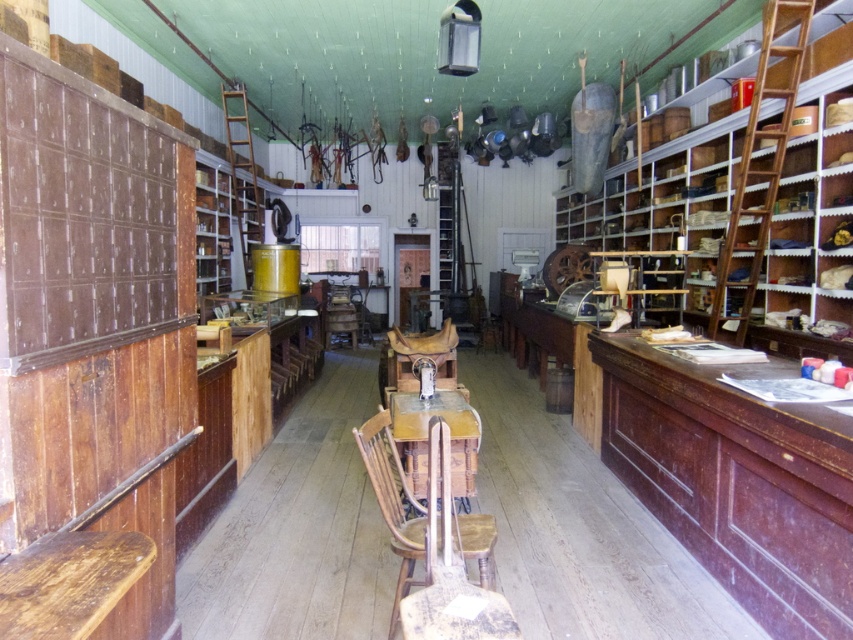
Question: Which point is closer to the camera taking this photo?

Choices:
 (A) (398, 394)
 (B) (418, 538)

Answer: (B)

Question: Among these objects, which one is nearest to the camera?

Choices:
 (A) wooden chair at center
 (B) wooden table at center

Answer: (A)

Question: In this image, where is wooden chair at center located relative to wooden table at center?

Choices:
 (A) left
 (B) right

Answer: (A)

Question: Considering the relative positions of wooden chair at center and wooden table at center in the image provided, where is wooden chair at center located with respect to wooden table at center?

Choices:
 (A) below
 (B) above

Answer: (A)

Question: Does wooden chair at center have a larger size compared to wooden table at center?

Choices:
 (A) yes
 (B) no

Answer: (A)